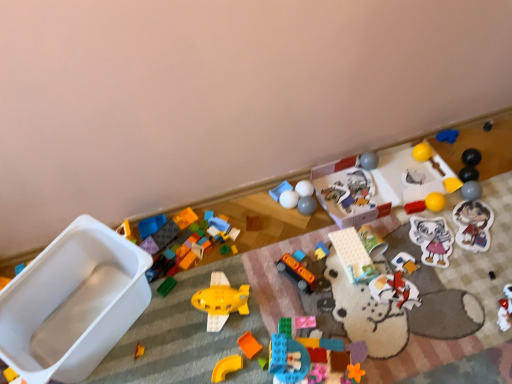
I want to click on vacant space that is in between yellow matte square at center-right, placed as the 22th toy when sorted from left to right, and white glossy sticker at center-right, arranged as the twentieth toy when viewed from the left, so click(x=442, y=213).